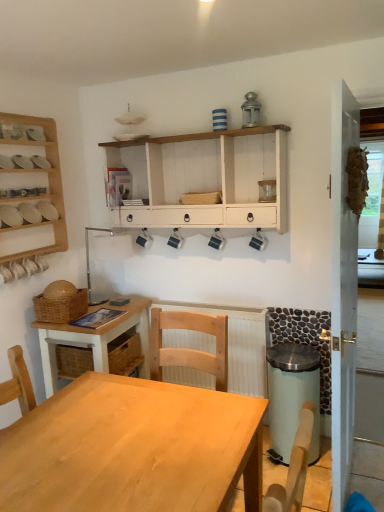
Question: Does woven brown basket at center, placed as the first basket when sorted from top to bottom, have a larger size compared to light wood table at center?

Choices:
 (A) yes
 (B) no

Answer: (B)

Question: Can you confirm if woven brown basket at center, placed as the first basket when sorted from top to bottom, is shorter than light wood table at center?

Choices:
 (A) no
 (B) yes

Answer: (B)

Question: Is woven brown basket at center, which is counted as the 1th basket, starting from the right, facing towards light wood table at center?

Choices:
 (A) yes
 (B) no

Answer: (B)

Question: Is the position of woven brown basket at center, the second basket ordered from the bottom, less distant than that of light wood table at center?

Choices:
 (A) yes
 (B) no

Answer: (B)

Question: From the image's perspective, is woven brown basket at center, the second basket ordered from the bottom, over light wood table at center?

Choices:
 (A) yes
 (B) no

Answer: (A)

Question: Is woven brown basket at center, which is counted as the 1th basket, starting from the right, smaller than light wood table at center?

Choices:
 (A) no
 (B) yes

Answer: (B)

Question: Is the depth of natural wood desk at left less than that of white matte bowls at upper left, the second shelf positioned from the right?

Choices:
 (A) yes
 (B) no

Answer: (A)

Question: Is natural wood desk at left at the right side of white matte bowls at upper left, the second shelf positioned from the right?

Choices:
 (A) no
 (B) yes

Answer: (B)

Question: Can you confirm if natural wood desk at left is taller than white matte bowls at upper left, the second shelf positioned from the right?

Choices:
 (A) yes
 (B) no

Answer: (A)

Question: From a real-world perspective, is natural wood desk at left beneath white matte bowls at upper left, the second shelf positioned from the right?

Choices:
 (A) no
 (B) yes

Answer: (B)

Question: From the image's perspective, is natural wood desk at left under white matte bowls at upper left, the 1th shelf viewed from the left?

Choices:
 (A) yes
 (B) no

Answer: (A)

Question: Is natural wood desk at left not close to white matte bowls at upper left, the 1th shelf viewed from the left?

Choices:
 (A) yes
 (B) no

Answer: (B)

Question: Is white painted wood shelf at upper center, arranged as the 1th shelf when viewed from the right, looking in the opposite direction of natural wood desk at left?

Choices:
 (A) yes
 (B) no

Answer: (B)